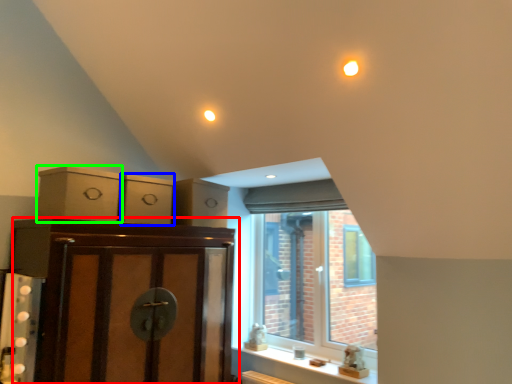
Question: Based on their relative distances, which object is farther from cabinetry (highlighted by a red box)? Choose from cabinetry (highlighted by a blue box) and cabinetry (highlighted by a green box).

Choices:
 (A) cabinetry
 (B) cabinetry

Answer: (A)